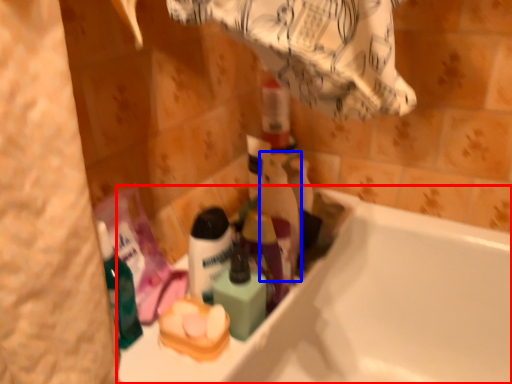
Question: Which object is further to the camera taking this photo, bathtub (highlighted by a red box) or cleaning product (highlighted by a blue box)?

Choices:
 (A) bathtub
 (B) cleaning product

Answer: (B)